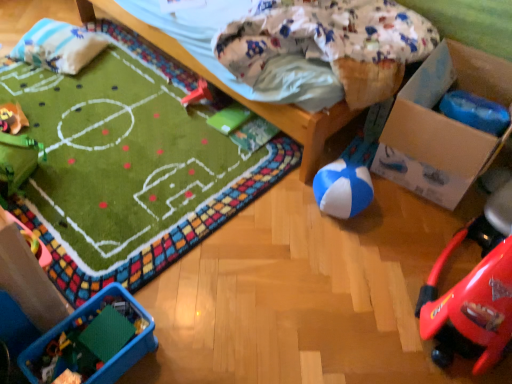
Question: From the image's perspective, is translucent plastic container at lower left, the 2th toy from the left, above or below rubberized red car at center, marked as the 4th toy in a bottom-to-top arrangement?

Choices:
 (A) above
 (B) below

Answer: (B)

Question: Considering the relative positions of translucent plastic container at lower left, which is the 3th toy from right to left, and rubberized red car at center, marked as the 4th toy in a bottom-to-top arrangement, in the image provided, is translucent plastic container at lower left, which is the 3th toy from right to left, to the left or to the right of rubberized red car at center, marked as the 4th toy in a bottom-to-top arrangement,?

Choices:
 (A) right
 (B) left

Answer: (B)

Question: Which is nearer to the plush yellow duck at upper left, which is counted as the fourth toy, starting from the right?

Choices:
 (A) translucent plastic container at lower left, positioned as the 1th toy in bottom-to-top order
 (B) wooden bed frame at upper center
 (C) white soft pillow at upper left
 (D) blue/white rubber ball at center-right, which ranks as the 3th toy in top-to-bottom order
 (E) cardboard box at lower right

Answer: (C)

Question: Which object is positioned farthest from the blue/white rubber ball at center-right, the fourth toy from the left?

Choices:
 (A) cardboard box at lower right
 (B) plush yellow duck at upper left, positioned as the 2th toy in top-to-bottom order
 (C) rubberized red car at center, which ranks as the first toy in top-to-bottom order
 (D) white soft pillow at upper left
 (E) translucent plastic container at lower left, the 2th toy from the left

Answer: (D)